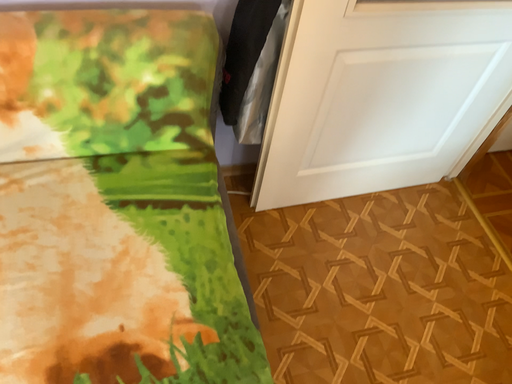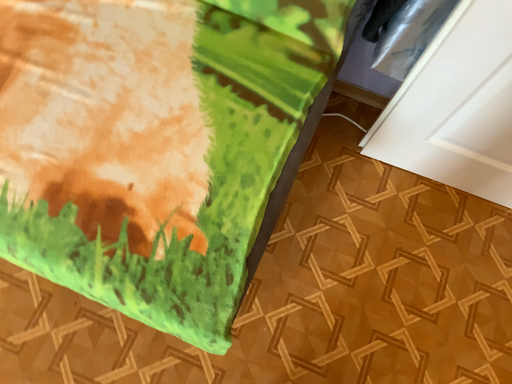
Question: How did the camera likely rotate when shooting the video?

Choices:
 (A) rotated downward
 (B) rotated upward

Answer: (A)